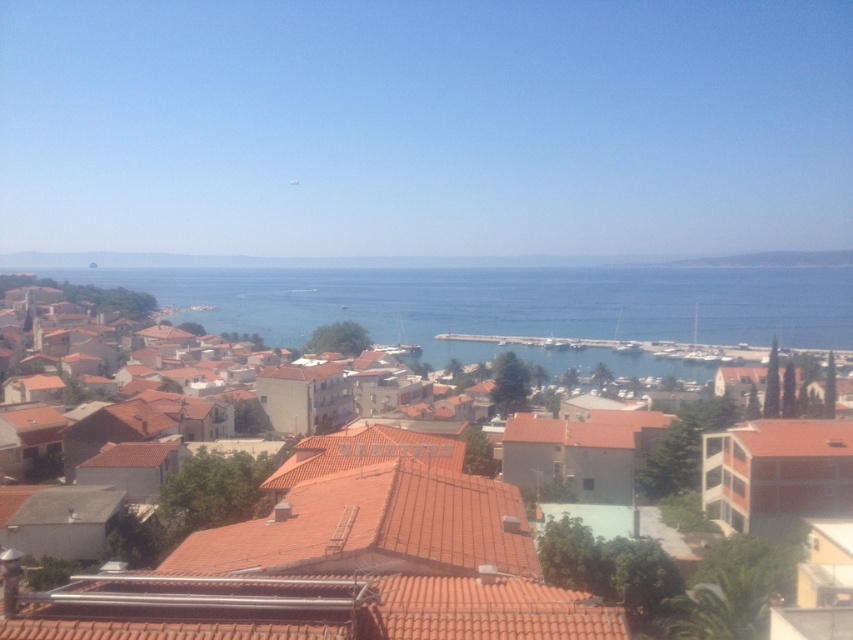
Consider the image. You are a tourist standing in the coastal town and want to take a photo that includes both the brown tile roofs at center and the blue water at center. Based on their heights, which object will appear larger in the photo?

The brown tile roofs at center has a lesser height compared to blue water at center, so the blue water at center will appear larger in the photo.

Consider the image. You are a tourist standing in the coastal town and looking at the brown tile roofs at center and the blue water at center. Which object appears smaller in the scene?

The brown tile roofs at center appears smaller compared to the blue water at center.

You are a drone operator flying over the coastal town. You need to capture a photo of the brown tile roofs at center and blue water at center. Which one is closer to the camera based on their positions in the image?

The brown tile roofs at center is positioned under blue water at center, meaning it is closer to the camera than the blue water at center.